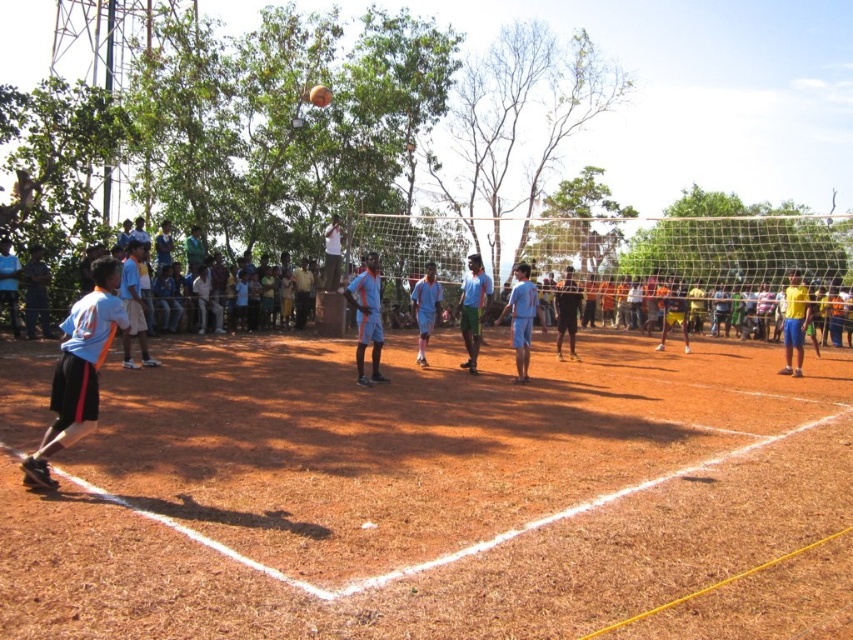
You are a photographer trying to capture the entire volleyball court in one shot. Given that the brown dirt field at center and the yellow fabric shorts at right are both in your frame, which object will occupy more space in the photo?

The brown dirt field at center occupies more space in the photo because it is bigger than the yellow fabric shorts at right according to the description.

You are a coach standing at the edge of the volleyball court. You need to quickly pass a water bottle to the player wearing the light blue jersey at left from the brown dirt field at center. Can you throw it directly without it hitting the net?

The distance between brown dirt field at center and light blue jersey at left is 4.40 meters. Since the volleyball net is placed at the center of the court, which is typically 9 meters wide, the net spans the entire width. Therefore, the 4.40 meters distance suggests the bottle would cross the net area. However, the net height is about 2.43 meters for men or 2.24 meters for women. If the bottle is thrown high enough to clear the net, it might reach, but if not, it could hit the net. Without knowing the team

You are a photographer standing at the edge of the volleyball court. You want to take a photo that includes both the point at position [366,545] and the point at position [798,282]. Which point will appear closer to the bottom of the photo?

Point [366,545] is closer to the camera than point [798,282], so in the photo, the point at [366,545] will appear closer to the bottom of the photo.